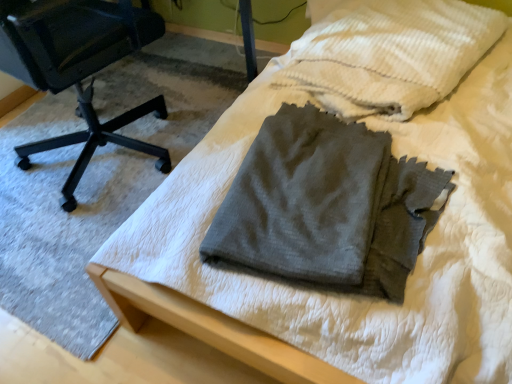
Identify the location of gray cotton towel at center. The image size is (512, 384). (391, 54).

You are a GUI agent. You are given a task and a screenshot of the screen. Output one action in this format:
    pyautogui.click(x=<x>, y=<y>)
    Task: Click on the black plastic chair at left
    The height and width of the screenshot is (384, 512).
    Given the screenshot: What is the action you would take?
    pyautogui.click(x=78, y=67)

This screenshot has width=512, height=384. What are the coordinates of `dark gray cotton pants at center` in the screenshot? It's located at (327, 206).

Can you tell me how much gray cotton towel at center and black plastic chair at left differ in facing direction?

gray cotton towel at center and black plastic chair at left are facing 101 degrees away from each other.

Between gray cotton towel at center and black plastic chair at left, which one has larger size?

black plastic chair at left is bigger.

Which object is further away from the camera, gray cotton towel at center or black plastic chair at left?

gray cotton towel at center is further away from the camera.

The height and width of the screenshot is (384, 512). Find the location of `cloth above the black plastic chair at left (from a real-world perspective)`. cloth above the black plastic chair at left (from a real-world perspective) is located at coordinates (391, 54).

Considering the positions of points (383, 46) and (339, 166), is point (383, 46) closer to camera compared to point (339, 166)?

That is False.

Can you tell me how much gray cotton towel at center and dark gray cotton pants at center differ in facing direction?

There is a 20.4-degree angle between the facing directions of gray cotton towel at center and dark gray cotton pants at center.

This screenshot has width=512, height=384. In the image, there is a dark gray cotton pants at center. Identify the location of cloth above it (from the image's perspective). (391, 54).

From a real-world perspective, is gray cotton towel at center located beneath dark gray cotton pants at center?

No.

Is the surface of dark gray cotton pants at center in direct contact with gray cotton towel at center?

There is a gap between dark gray cotton pants at center and gray cotton towel at center.

Considering the positions of point (337, 231) and point (425, 86), is point (337, 231) closer or farther from the camera than point (425, 86)?

Point (337, 231).

Could you tell me if dark gray cotton pants at center is turned towards gray cotton towel at center?

No, dark gray cotton pants at center does not turn towards gray cotton towel at center.

Who is more distant, dark gray cotton pants at center or gray cotton towel at center?

gray cotton towel at center is further away from the camera.

Considering the relative sizes of black plastic chair at left and dark gray cotton pants at center in the image provided, is black plastic chair at left thinner than dark gray cotton pants at center?

No.

Is black plastic chair at left smaller than dark gray cotton pants at center?

No, black plastic chair at left is not smaller than dark gray cotton pants at center.

From the image's perspective, which one is positioned higher, black plastic chair at left or dark gray cotton pants at center?

black plastic chair at left.

Which is more to the left, black plastic chair at left or dark gray cotton pants at center?

black plastic chair at left.

Between dark gray cotton pants at center and black plastic chair at left, which one appears on the left side from the viewer's perspective?

black plastic chair at left is more to the left.

How different are the orientations of dark gray cotton pants at center and black plastic chair at left in degrees?

They differ by 80.9 degrees in their facing directions.

Consider the image. From the image's perspective, who appears lower, dark gray cotton pants at center or black plastic chair at left?

dark gray cotton pants at center is shown below in the image.

In the image, there is a black plastic chair at left. Identify the location of laundry below it (from a real-world perspective). The width and height of the screenshot is (512, 384). (327, 206).

From the image's perspective, is black plastic chair at left on top of gray cotton towel at center?

No, from the image's perspective, black plastic chair at left is not on top of gray cotton towel at center.

Between black plastic chair at left and gray cotton towel at center, which one is positioned behind?

gray cotton towel at center is further from the camera.

Who is bigger, black plastic chair at left or gray cotton towel at center?

Bigger between the two is black plastic chair at left.

Identify the location of chair that appears below the gray cotton towel at center (from the image's perspective). This screenshot has height=384, width=512. (78, 67).

What are the coordinates of `cloth behind the dark gray cotton pants at center` in the screenshot? It's located at (391, 54).

When comparing their distances from dark gray cotton pants at center, does gray cotton towel at center or black plastic chair at left seem further?

black plastic chair at left is further to dark gray cotton pants at center.

When comparing their distances from black plastic chair at left, does gray cotton towel at center or dark gray cotton pants at center seem further?

dark gray cotton pants at center.

Based on their spatial positions, is black plastic chair at left or dark gray cotton pants at center closer to gray cotton towel at center?

Based on the image, dark gray cotton pants at center appears to be nearer to gray cotton towel at center.

Considering their positions, is dark gray cotton pants at center positioned closer to black plastic chair at left than gray cotton towel at center?

Among the two, gray cotton towel at center is located nearer to black plastic chair at left.

Based on their spatial positions, is dark gray cotton pants at center or black plastic chair at left closer to gray cotton towel at center?

dark gray cotton pants at center is positioned closer to the anchor gray cotton towel at center.

Estimate the real-world distances between objects in this image. Which object is closer to dark gray cotton pants at center, black plastic chair at left or gray cotton towel at center?

Among the two, gray cotton towel at center is located nearer to dark gray cotton pants at center.

You are a GUI agent. You are given a task and a screenshot of the screen. Output one action in this format:
    pyautogui.click(x=<x>, y=<y>)
    Task: Click on the laundry between black plastic chair at left and gray cotton towel at center in the horizontal direction
    Image resolution: width=512 pixels, height=384 pixels.
    Given the screenshot: What is the action you would take?
    pyautogui.click(x=327, y=206)